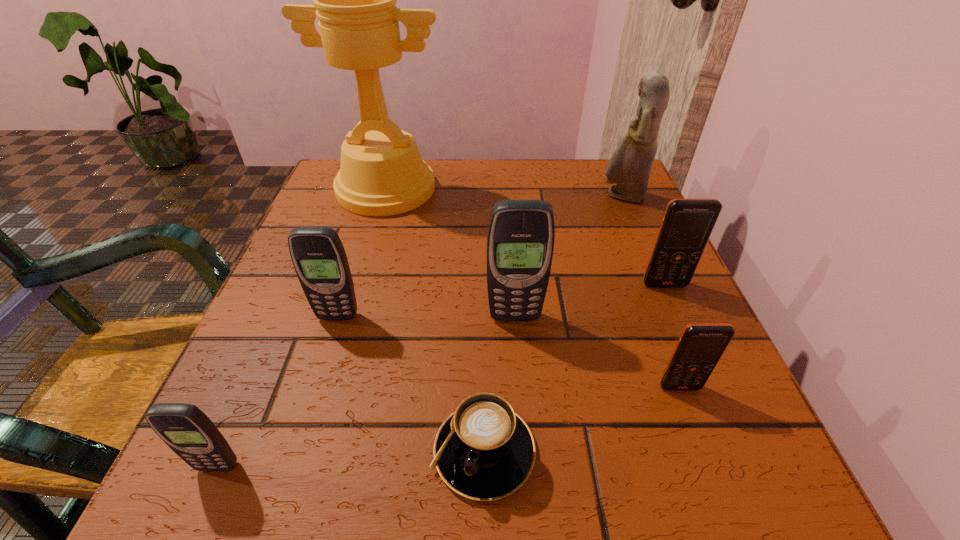
Find the location of a particular element. Image resolution: width=960 pixels, height=540 pixels. object that is at the far left corner is located at coordinates (382, 173).

Where is `object that is at the near left corner`? The image size is (960, 540). object that is at the near left corner is located at coordinates (189, 432).

At what (x,y) coordinates should I click in order to perform the action: click on object that is at the far right corner. Please return your answer as a coordinate pair (x, y). Looking at the image, I should click on (630, 165).

Locate an element on the screen. vacant space at the far edge of the desktop is located at coordinates (564, 179).

Locate an element on the screen. vacant space at the left edge of the desktop is located at coordinates (289, 313).

In order to click on vacant space at the right edge of the desktop in this screenshot , I will do `click(618, 284)`.

At what (x,y) coordinates should I click in order to perform the action: click on vacant space at the far right corner of the desktop. Please return your answer as a coordinate pair (x, y). The image size is (960, 540). Looking at the image, I should click on (596, 169).

Identify the location of free space at the near right corner of the desktop. This screenshot has width=960, height=540. (709, 475).

Find the location of a particular element. This screenshot has height=540, width=960. free space between the third nearest object and the farther orange cellular telephone is located at coordinates pos(672,336).

I want to click on vacant area that lies between the tallest object and the figurine, so (504, 192).